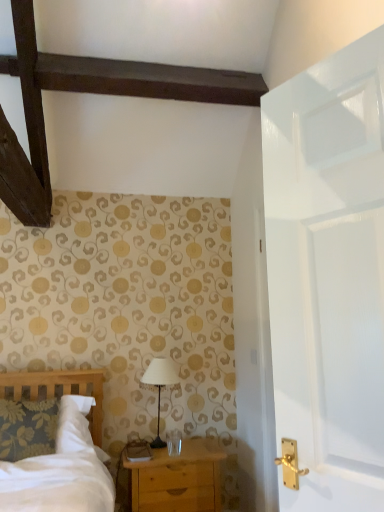
Locate an element on the screen. The width and height of the screenshot is (384, 512). vacant space situated above light brown wooden chest of drawers at lower center (from a real-world perspective) is located at coordinates (186, 448).